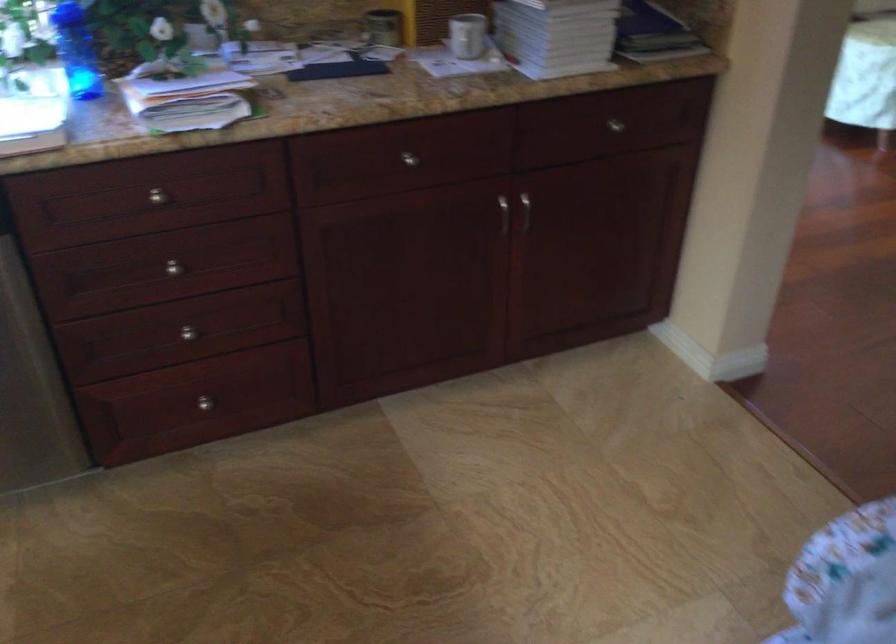
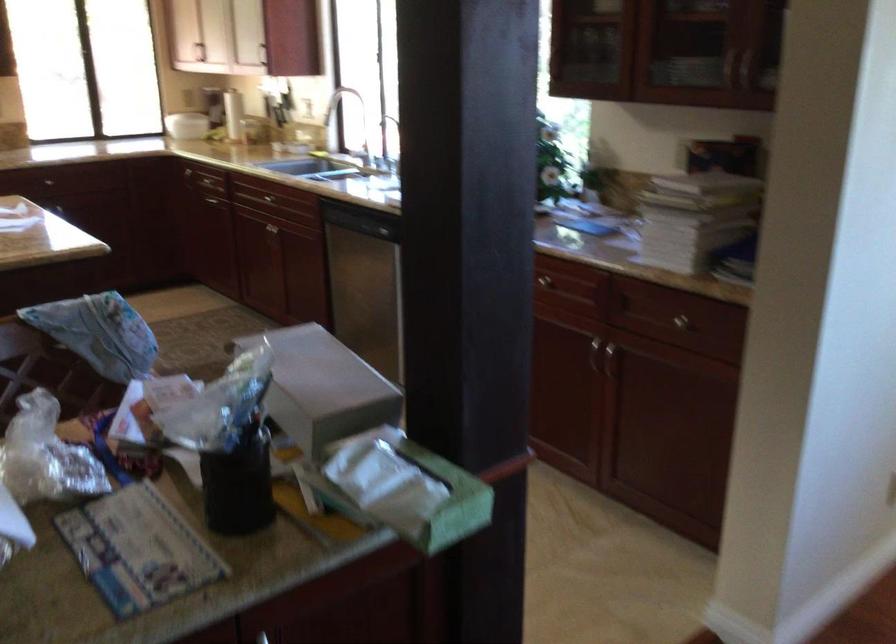
Find the pixel in the second image that matches (618,124) in the first image.

(682, 323)